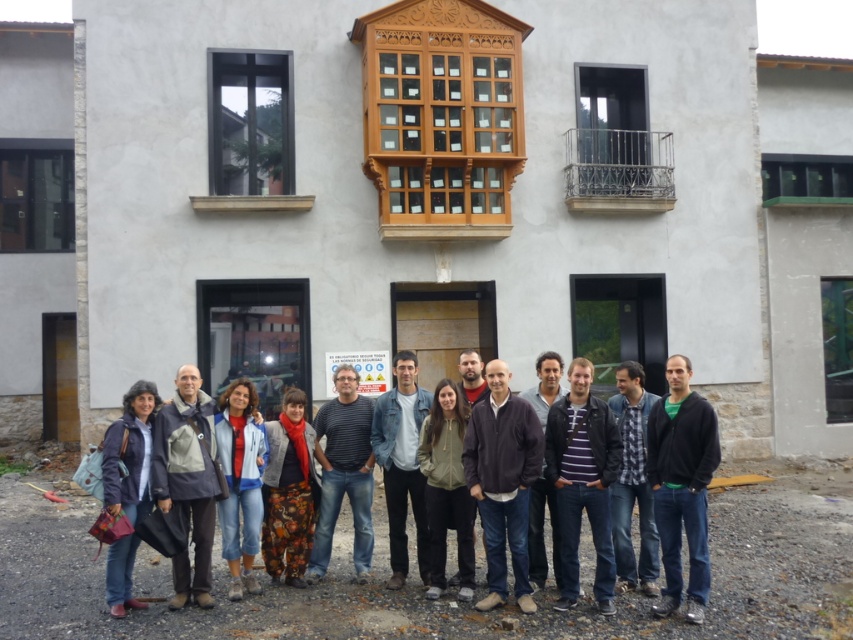
How much distance is there between striped cotton shirt at center and matte blue jacket at lower left?

striped cotton shirt at center and matte blue jacket at lower left are 1.74 meters apart.

The width and height of the screenshot is (853, 640). What are the coordinates of `striped cotton shirt at center` in the screenshot? It's located at (344, 472).

This screenshot has height=640, width=853. What are the coordinates of `striped cotton shirt at center` in the screenshot? It's located at (344, 472).

Does denim jacket at center appear on the left side of plaid fabric shirt at center?

Correct, you'll find denim jacket at center to the left of plaid fabric shirt at center.

Between point (392, 541) and point (641, 518), which one is positioned in front?

Point (641, 518)

Locate an element on the screen. denim jacket at center is located at coordinates (402, 464).

Who is more distant from viewer, (491, 476) or (260, 461)?

Positioned behind is point (260, 461).

Is dark brown sweater at center taller than blue denim jeans at center?

Indeed, dark brown sweater at center has a greater height compared to blue denim jeans at center.

What do you see at coordinates (502, 481) in the screenshot?
I see `dark brown sweater at center` at bounding box center [502, 481].

I want to click on dark brown sweater at center, so click(x=502, y=481).